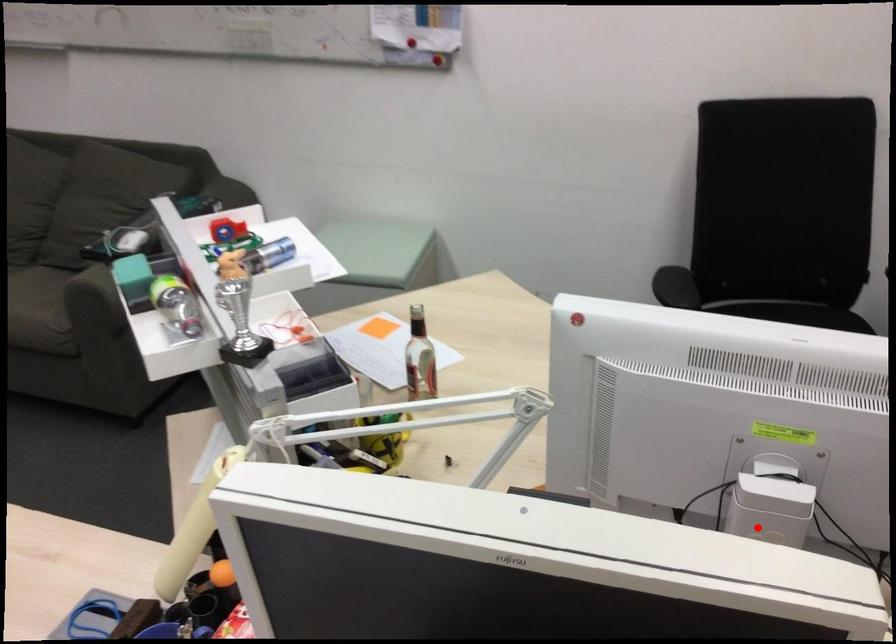
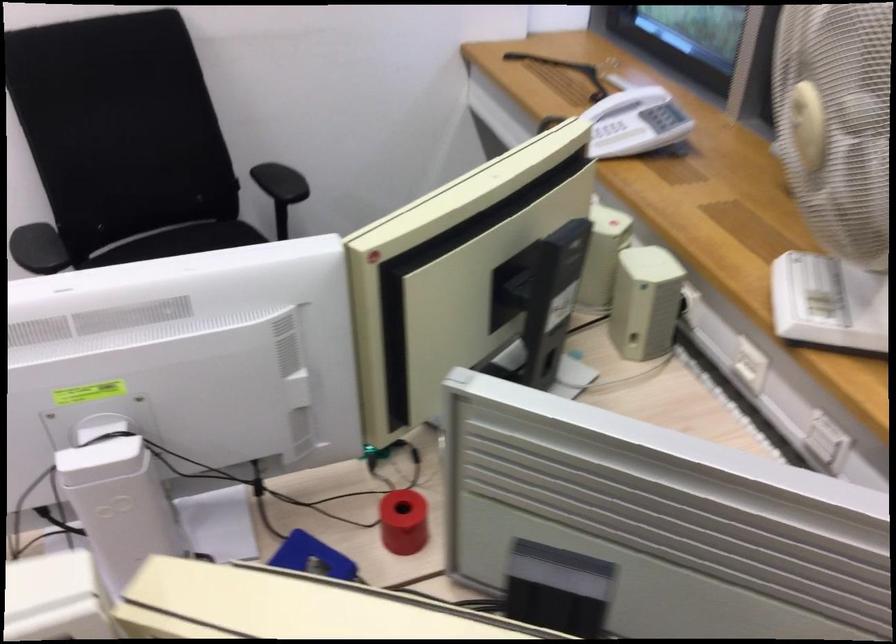
In the second image, find the point that corresponds to the highlighted location in the first image.

(118, 500)